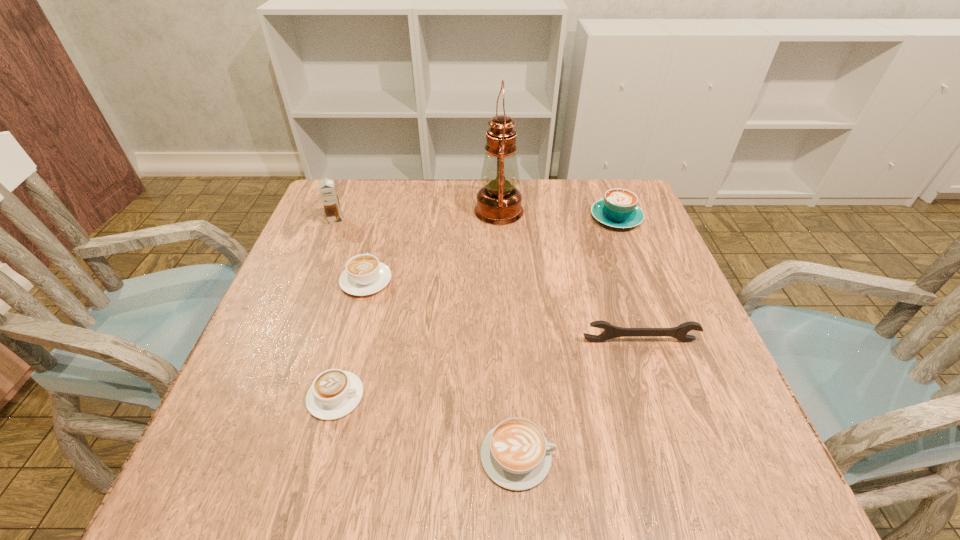
I want to click on vacant space located on the right of the oil lamp, so click(x=624, y=211).

Where is `vacant area situated on the right of the leftmost object`? vacant area situated on the right of the leftmost object is located at coordinates (378, 220).

Locate an element on the screen. free space located 0.130m with the handle on the right side of the tallest cappuccino is located at coordinates (601, 179).

What are the coordinates of `blank space located 0.280m on the open ends of the wrench` in the screenshot? It's located at (689, 491).

This screenshot has height=540, width=960. I want to click on free space located 0.300m on the side of the second farthest cappuccino with the handle, so click(390, 194).

Identify the location of free point located 0.070m on the side of the second farthest cappuccino with the handle. (376, 245).

Identify the location of vacant space located on the side of the second farthest cappuccino with the handle. [x=392, y=188].

Where is `free region located with the handle on the right side of the second nearest object`? The image size is (960, 540). free region located with the handle on the right side of the second nearest object is located at coordinates (471, 396).

The height and width of the screenshot is (540, 960). I want to click on free space located 0.200m on the side of the third cappuccino from left to right with the handle, so click(681, 455).

Identify the location of oil lamp present at the far edge. The width and height of the screenshot is (960, 540). (499, 202).